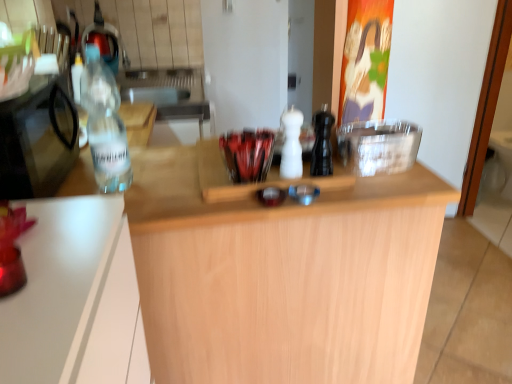
The height and width of the screenshot is (384, 512). In order to click on free spot in front of clear plastic container at center, the first appliance from the right in this screenshot , I will do `click(385, 178)`.